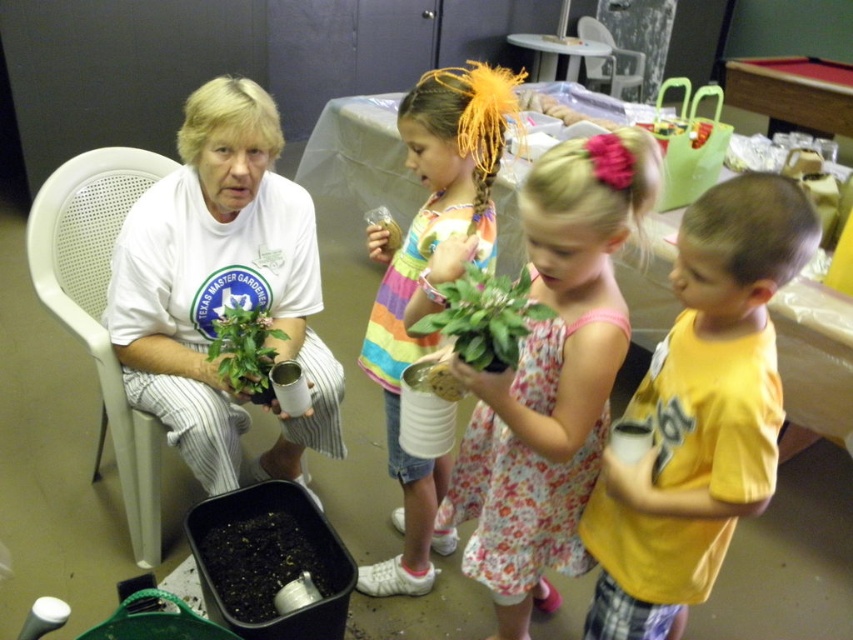
You are a visitor at this indoor gardening event and want to know which object is narrower between the green matte plant at center and the white plastic chair at upper center. Can you tell me?

The green matte plant at center is thinner than the white plastic chair at upper center, so the green matte plant at center is narrower.

You are a photographer trying to capture a closeup of the green matte plant at center without including the white plastic chair at upper center in the frame. Based on their positions, is this possible?

Yes, because the green matte plant at center is closer to the viewer than the white plastic chair at upper center, the photographer can adjust the camera angle to focus on the plant while excluding the chair from the shot.